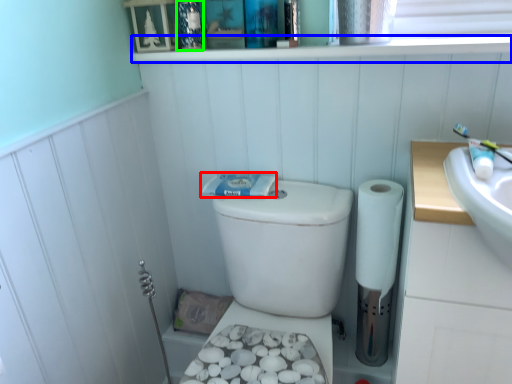
Question: Estimate the real-world distances between objects in this image. Which object is farther from toothpaste (highlighted by a red box), ledge (highlighted by a blue box) or toiletry (highlighted by a green box)?

Choices:
 (A) ledge
 (B) toiletry

Answer: (B)